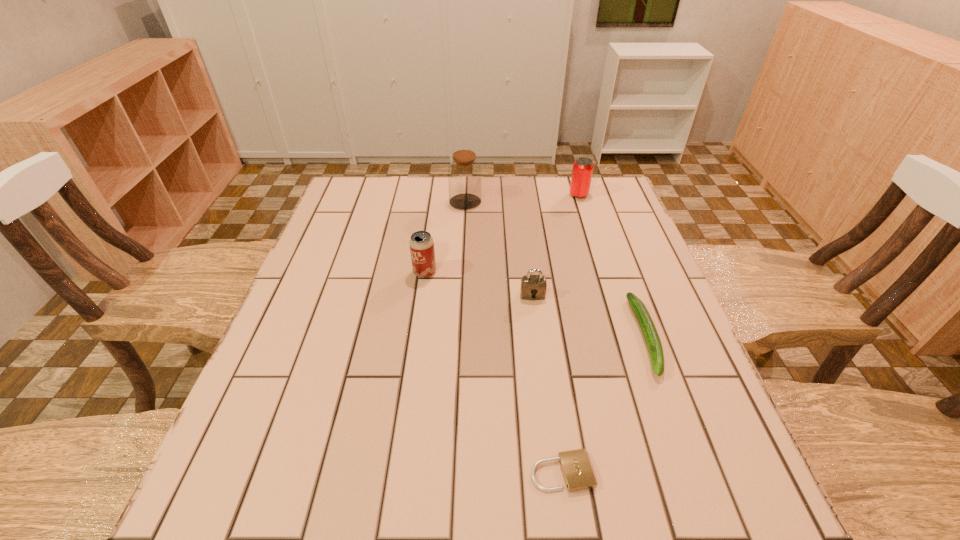
Find the location of a particular element. This screenshot has height=540, width=960. the shortest object is located at coordinates coord(575,465).

I want to click on blank area located 0.260m on the right of the jar, so click(565, 202).

You are a GUI agent. You are given a task and a screenshot of the screen. Output one action in this format:
    pyautogui.click(x=<x>, y=<y>)
    Task: Click on the free space located 0.050m on the back of the can
    This screenshot has width=960, height=540.
    Given the screenshot: What is the action you would take?
    pyautogui.click(x=574, y=182)

In order to click on vacant space located 0.230m on the right of the leftmost object in this screenshot , I will do `click(526, 272)`.

This screenshot has height=540, width=960. I want to click on vacant space located 0.300m at the front of the third shortest object near the keyhole, so click(x=547, y=414).

Find the location of `vacant area situated on the front-facing side of the second shortest object`. vacant area situated on the front-facing side of the second shortest object is located at coordinates (696, 476).

The width and height of the screenshot is (960, 540). I want to click on vacant space located on the left of the nearest object, so click(477, 472).

Locate an element on the screen. This screenshot has width=960, height=540. jar that is at the far edge is located at coordinates (464, 173).

Identify the location of can located at the far edge. Image resolution: width=960 pixels, height=540 pixels. (582, 171).

You are a GUI agent. You are given a task and a screenshot of the screen. Output one action in this format:
    pyautogui.click(x=<x>, y=<y>)
    Task: Click on the object that is at the near edge
    This screenshot has width=960, height=540.
    Given the screenshot: What is the action you would take?
    pyautogui.click(x=575, y=465)